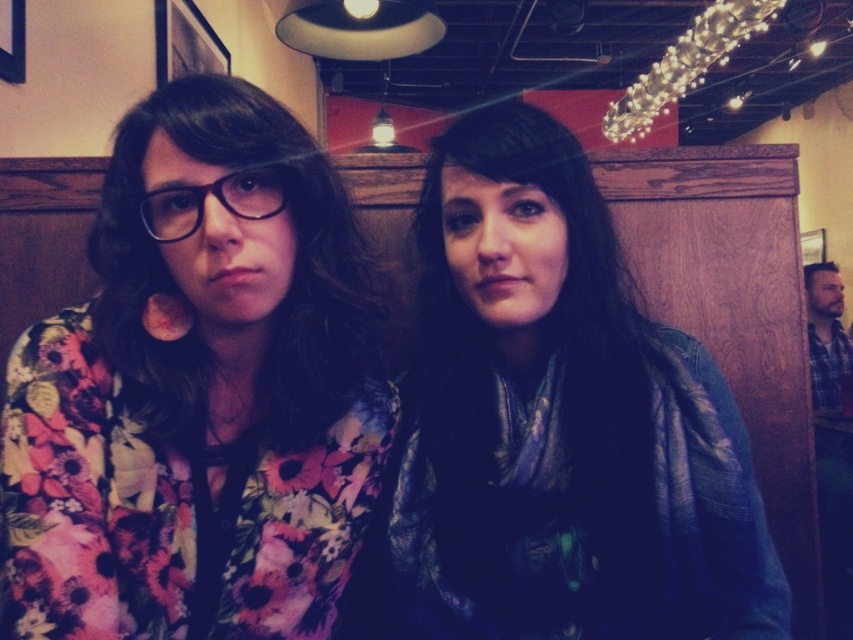
Which is behind, point (1, 461) or point (167, 195)?

The point (1, 461) is behind.

This screenshot has height=640, width=853. I want to click on floral fabric shirt at left, so click(198, 390).

This screenshot has height=640, width=853. In order to click on floral fabric shirt at left in this screenshot , I will do `click(198, 390)`.

Is floral fabric shirt at left further to the viewer compared to shiny blue scarf at center?

No, it is not.

What do you see at coordinates (198, 390) in the screenshot? I see `floral fabric shirt at left` at bounding box center [198, 390].

Who is more distant from viewer, (283,195) or (648,572)?

The point (648,572) is behind.

Where is `floral fabric shirt at left`? floral fabric shirt at left is located at coordinates (198, 390).

Between point (509, 195) and point (173, 204), which one is positioned behind?

Positioned behind is point (509, 195).

Describe the element at coordinates (561, 422) in the screenshot. This screenshot has width=853, height=640. I see `shiny blue scarf at center` at that location.

The width and height of the screenshot is (853, 640). What are the coordinates of `shiny blue scarf at center` in the screenshot? It's located at (x=561, y=422).